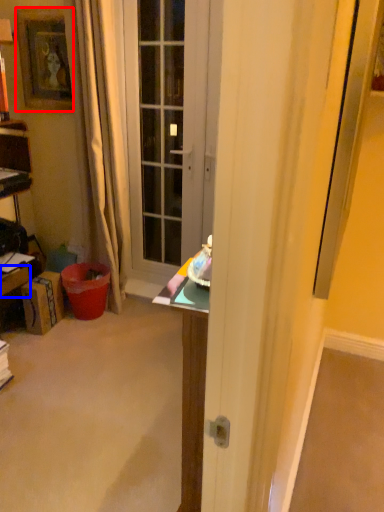
Question: Which point is closer to the camera, picture frame (highlighted by a red box) or drawer (highlighted by a blue box)?

Choices:
 (A) picture frame
 (B) drawer

Answer: (B)